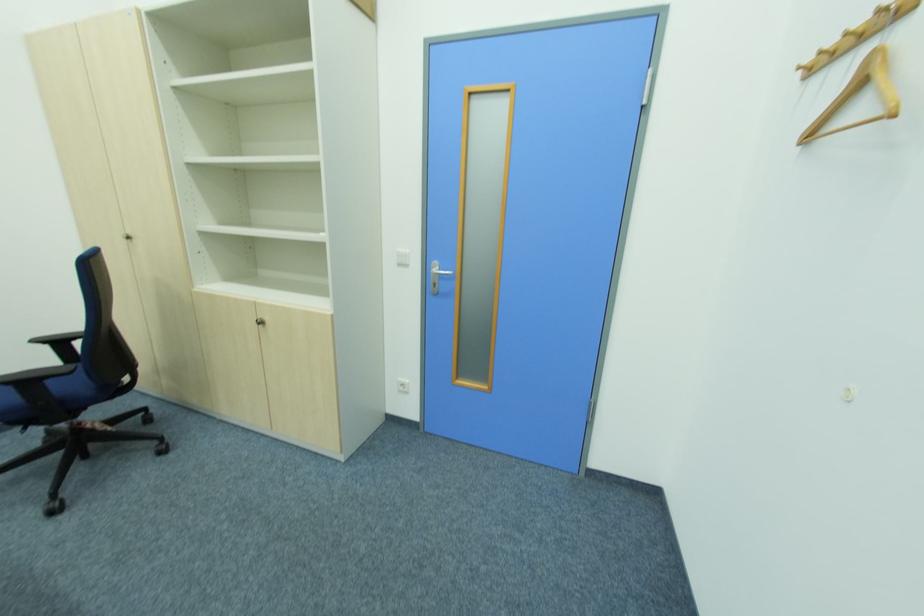
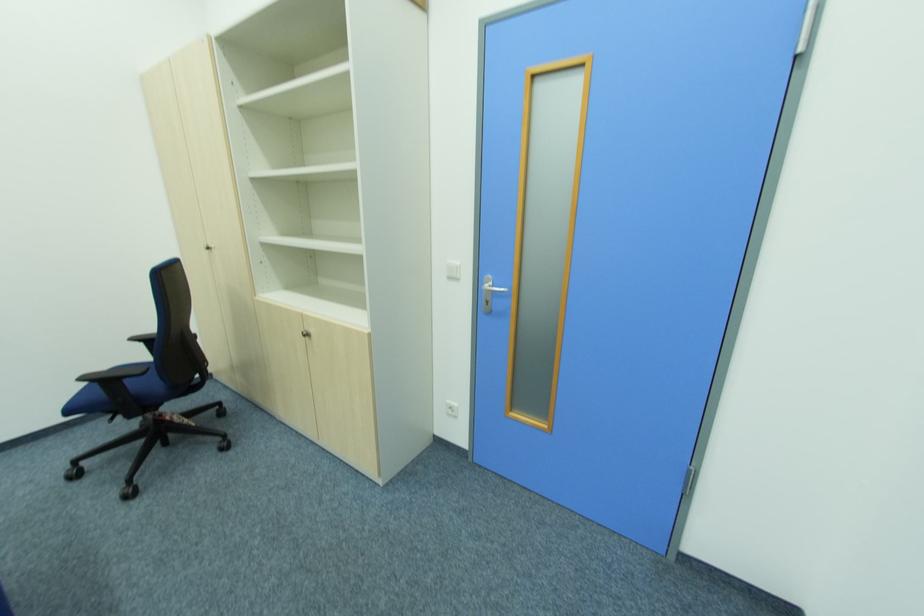
In a continuous first-person perspective shot, in which direction is the camera moving?

The cameraman moved toward right, forward.